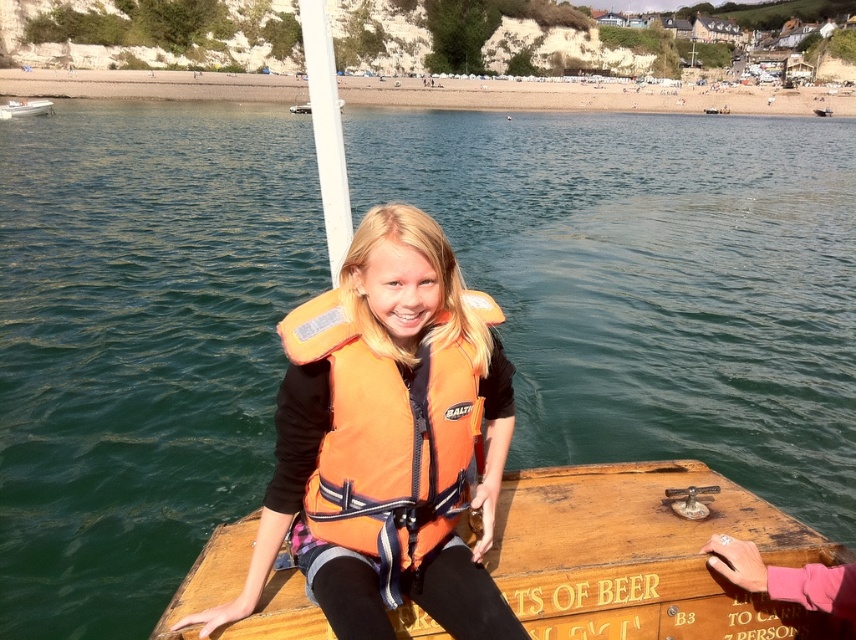
Does point (837, 550) lie behind point (491, 433)?

No, it is not.

Does point (544, 632) come behind point (381, 225)?

No, it is in front of (381, 225).

What are the coordinates of `wooden raft at center` in the screenshot? It's located at (643, 556).

Is orange life vest at center above orange fabric life jacket at center?

No, orange life vest at center is not above orange fabric life jacket at center.

Which is more to the right, orange life vest at center or orange fabric life jacket at center?

orange fabric life jacket at center

Which is in front, point (437, 609) or point (465, 451)?

Point (437, 609) is in front.

Locate an element on the screen. The width and height of the screenshot is (856, 640). orange life vest at center is located at coordinates (401, 408).

Does point (408, 339) come in front of point (51, 104)?

Yes, it is.

Does orange life vest at center appear on the left side of white plastic boat at upper left?

No, orange life vest at center is not to the left of white plastic boat at upper left.

Where is `orange life vest at center`? Image resolution: width=856 pixels, height=640 pixels. orange life vest at center is located at coordinates (401, 408).

Where is `orange life vest at center`? This screenshot has height=640, width=856. orange life vest at center is located at coordinates (401, 408).